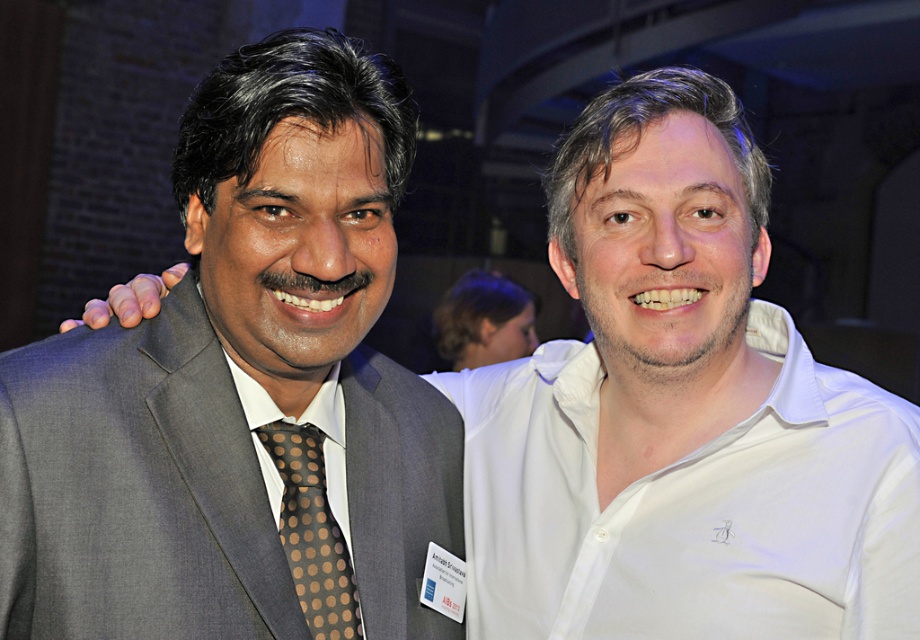
Is gray fabric suit at left taller than brown dotted fabric tie at left?

Indeed, gray fabric suit at left has a greater height compared to brown dotted fabric tie at left.

Can you confirm if gray fabric suit at left is thinner than brown dotted fabric tie at left?

In fact, gray fabric suit at left might be wider than brown dotted fabric tie at left.

Which is behind, point (415, 412) or point (299, 534)?

The point (415, 412) is more distant.

Where is `gray fabric suit at left`? The width and height of the screenshot is (920, 640). gray fabric suit at left is located at coordinates (135, 490).